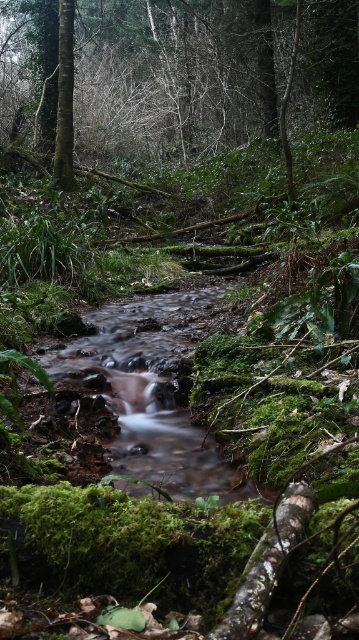
Does point (288, 74) lie behind point (128, 488)?

Yes, it is behind point (128, 488).

Between green mossy tree at center and clear water at center, which one is positioned lower?

clear water at center is lower down.

This screenshot has width=359, height=640. I want to click on green mossy tree at center, so click(207, 76).

I want to click on green mossy tree at center, so click(207, 76).